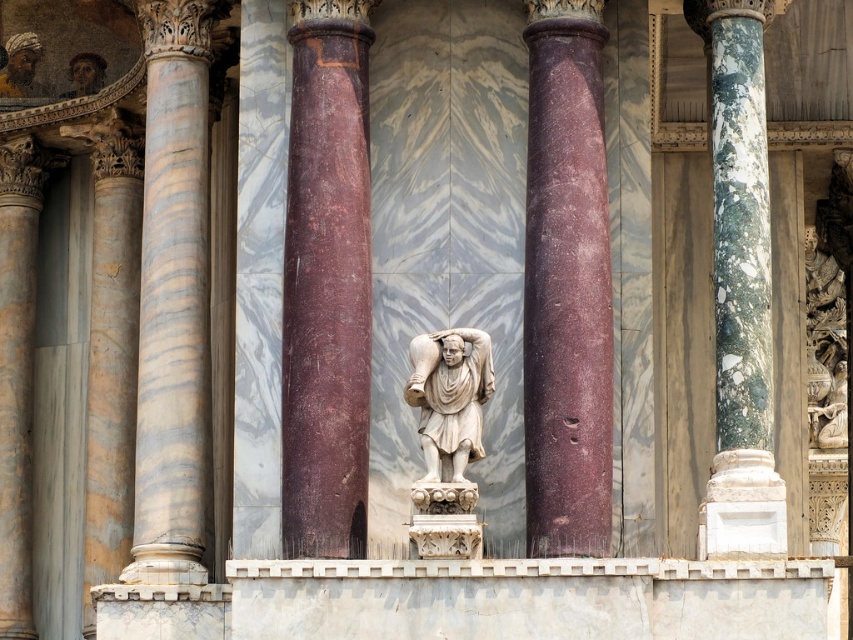
Does marble column at center have a greater width compared to marble column at left?

In fact, marble column at center might be narrower than marble column at left.

Does marble column at center have a lesser width compared to marble column at left?

Yes.

At what (x,y) coordinates should I click in order to perform the action: click on marble column at center. Please return your answer as a coordinate pair (x, y). The width and height of the screenshot is (853, 640). Looking at the image, I should click on (326, 282).

Where is `marble column at center`? This screenshot has height=640, width=853. marble column at center is located at coordinates (326, 282).

Which is more to the left, green marble column at right or white marble statue at center?

white marble statue at center

Between point (727, 442) and point (422, 435), which one is positioned in front?

Point (422, 435)

In order to click on green marble column at right in this screenshot , I will do `click(741, 294)`.

Does purple marble column at center appear on the left side of white marble statue at center?

No, purple marble column at center is not to the left of white marble statue at center.

Is point (547, 556) less distant than point (415, 362)?

No, it is not.

Does point (547, 20) lie in front of point (454, 400)?

No, it is behind (454, 400).

Where is `purple marble column at center`? This screenshot has height=640, width=853. purple marble column at center is located at coordinates (566, 285).